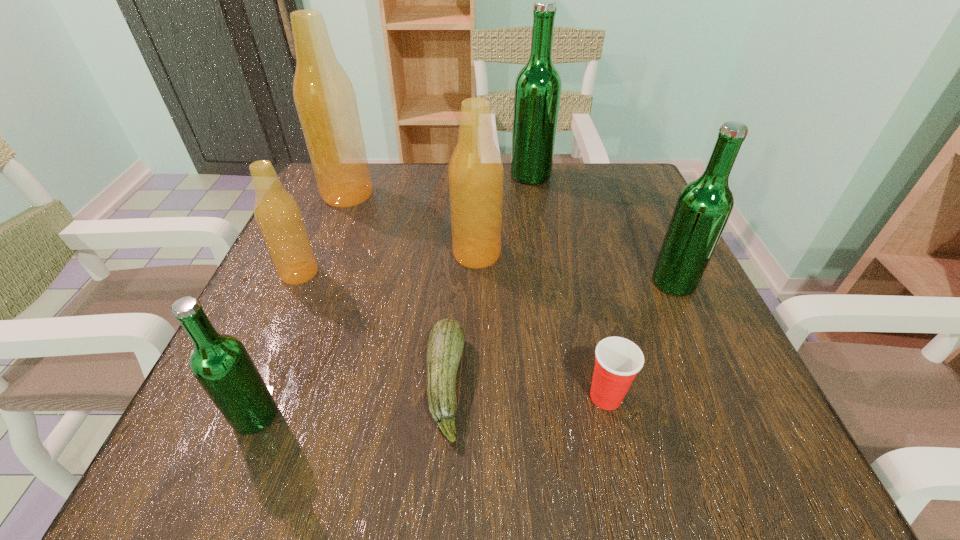
Find the location of a particular element. The height and width of the screenshot is (540, 960). free space between the smallest green beer bottle and the smallest tan beer bottle is located at coordinates (277, 345).

Find the location of a particular element. free spot between the leftmost green beer bottle and the second smallest tan beer bottle is located at coordinates (366, 335).

Where is `vacant region between the second smallest tan beer bottle and the rightmost object`? The width and height of the screenshot is (960, 540). vacant region between the second smallest tan beer bottle and the rightmost object is located at coordinates (575, 268).

Locate an element on the screen. object that ranks as the sixth closest to the smallest tan beer bottle is located at coordinates (618, 360).

Where is `object that is the fifth closest one to the rightmost beer bottle`? Image resolution: width=960 pixels, height=540 pixels. object that is the fifth closest one to the rightmost beer bottle is located at coordinates (325, 100).

Locate an element on the screen. the third closest beer bottle to the third beer bottle from right to left is located at coordinates (278, 216).

Identify the location of beer bottle that is the fifth closest to the rightmost beer bottle. (221, 364).

Locate which green beer bottle is the third closest to the shortest object. Please provide its 2D coordinates. Your answer should be formatted as a tuple, i.e. [(x, y)], where the tuple contains the x and y coordinates of a point satisfying the conditions above.

[(538, 86)]

Image resolution: width=960 pixels, height=540 pixels. In order to click on green beer bottle that is the second closest one to the second biggest tan beer bottle in this screenshot , I will do `click(703, 208)`.

Identify which tan beer bottle is located as the second nearest to the smallest tan beer bottle. Please provide its 2D coordinates. Your answer should be formatted as a tuple, i.e. [(x, y)], where the tuple contains the x and y coordinates of a point satisfying the conditions above.

[(476, 173)]